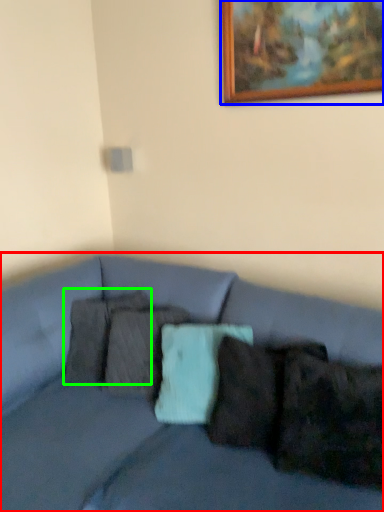
Question: Which object is the closest to the studio couch (highlighted by a red box)? Choose among these: picture frame (highlighted by a blue box) or pillow (highlighted by a green box).

Choices:
 (A) picture frame
 (B) pillow

Answer: (B)